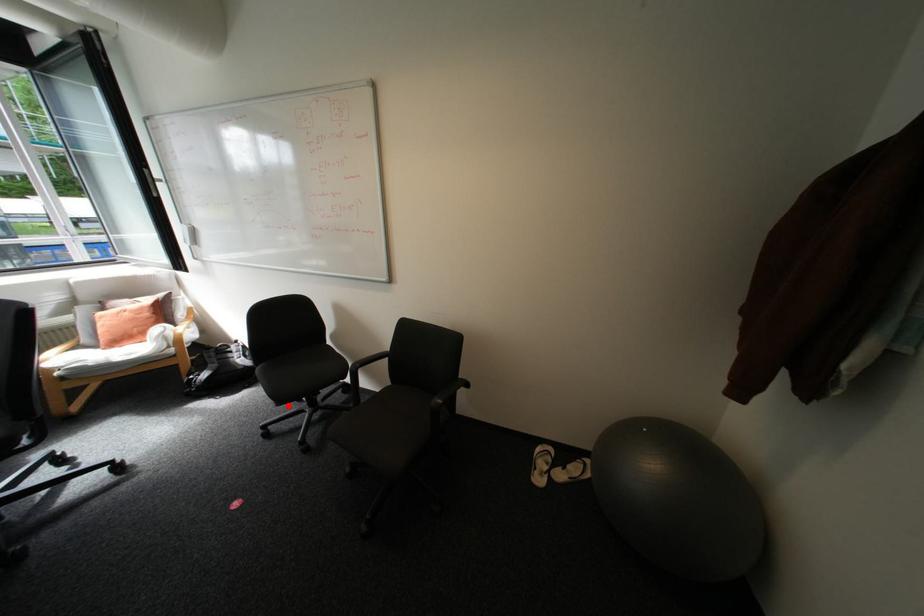
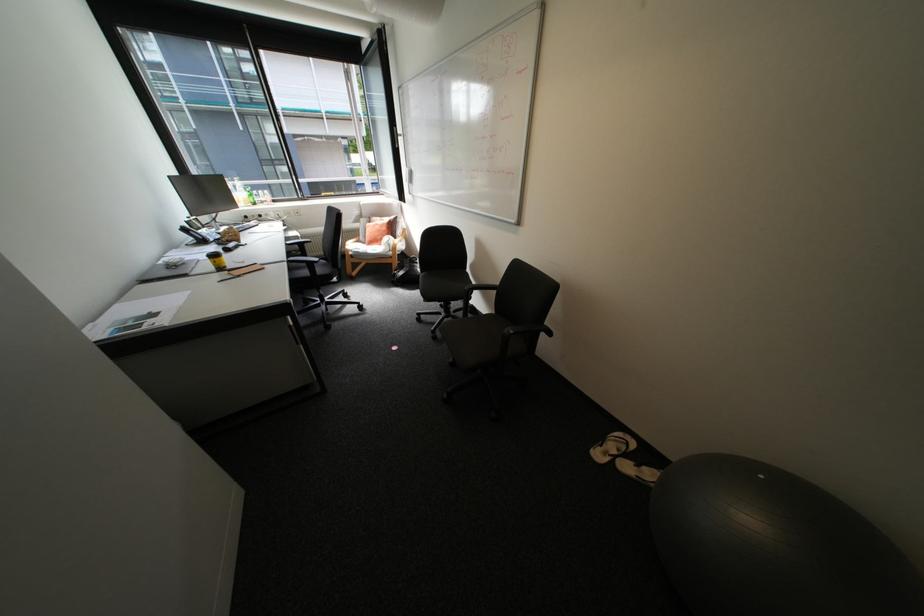
Locate, in the second image, the point that corresponds to the highlighted location in the first image.

(434, 302)